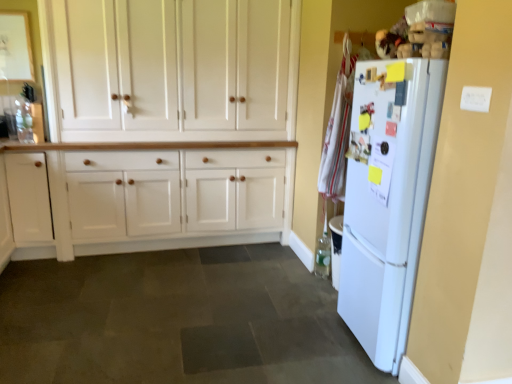
Question: From the image's perspective, is white wood cabinet at center, which appears as the 2th cabinetry when viewed from the left, located beneath white matte refrigerator at right?

Choices:
 (A) no
 (B) yes

Answer: (A)

Question: Does white wood cabinet at center, which appears as the 2th cabinetry when viewed from the left, have a greater width compared to white matte refrigerator at right?

Choices:
 (A) no
 (B) yes

Answer: (A)

Question: Does white wood cabinet at center, which appears as the 2th cabinetry when viewed from the left, turn towards white matte refrigerator at right?

Choices:
 (A) yes
 (B) no

Answer: (A)

Question: Is white wood cabinet at center, which appears as the 2th cabinetry when viewed from the left, further to the viewer compared to white matte refrigerator at right?

Choices:
 (A) yes
 (B) no

Answer: (A)

Question: Is white wood cabinet at center, which ranks as the first cabinetry in right-to-left order, smaller than white matte refrigerator at right?

Choices:
 (A) yes
 (B) no

Answer: (B)

Question: Considering the relative sizes of white wood cabinet at center, which ranks as the first cabinetry in right-to-left order, and white matte refrigerator at right in the image provided, is white wood cabinet at center, which ranks as the first cabinetry in right-to-left order, shorter than white matte refrigerator at right?

Choices:
 (A) yes
 (B) no

Answer: (B)

Question: Is dark gray tile floor at center oriented towards white wood cabinet at left, which ranks as the first cabinetry in left-to-right order?

Choices:
 (A) yes
 (B) no

Answer: (B)

Question: Does dark gray tile floor at center come in front of white wood cabinet at left, which ranks as the first cabinetry in left-to-right order?

Choices:
 (A) no
 (B) yes

Answer: (B)

Question: Can you confirm if dark gray tile floor at center is taller than white wood cabinet at left, which ranks as the first cabinetry in left-to-right order?

Choices:
 (A) no
 (B) yes

Answer: (A)

Question: From a real-world perspective, is dark gray tile floor at center over white wood cabinet at left, the 2th cabinetry when ordered from right to left?

Choices:
 (A) no
 (B) yes

Answer: (A)

Question: Is white wood cabinet at left, the 2th cabinetry when ordered from right to left, located within dark gray tile floor at center?

Choices:
 (A) yes
 (B) no

Answer: (B)

Question: Considering the relative sizes of dark gray tile floor at center and white wood cabinet at left, the 2th cabinetry when ordered from right to left, in the image provided, is dark gray tile floor at center shorter than white wood cabinet at left, the 2th cabinetry when ordered from right to left,?

Choices:
 (A) yes
 (B) no

Answer: (A)

Question: Does white wood cabinet at left, which ranks as the first cabinetry in left-to-right order, have a greater width compared to white matte refrigerator at right?

Choices:
 (A) no
 (B) yes

Answer: (A)